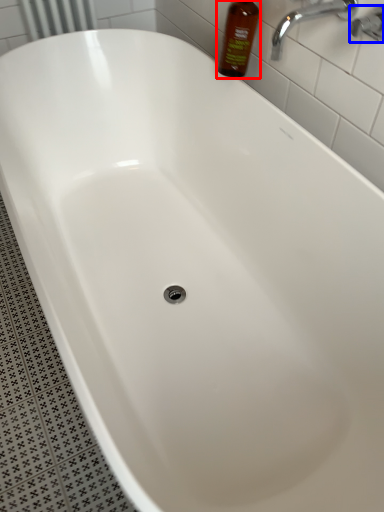
Question: Which object appears closest to the camera in this image, bottle (highlighted by a red box) or plumbing fixture (highlighted by a blue box)?

Choices:
 (A) bottle
 (B) plumbing fixture

Answer: (B)